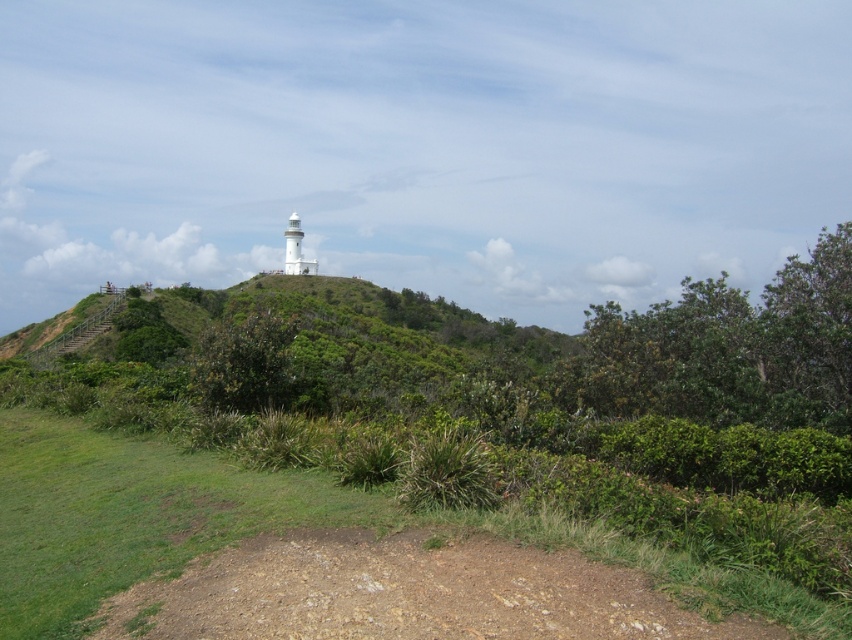
You are standing at the base of the hill looking towards the lighthouse. There are two points marked on the image. Which point, point (x=845, y=609) or point (x=636, y=589), is closer to you?

Point (x=845, y=609) is closer to the camera than point (x=636, y=589).